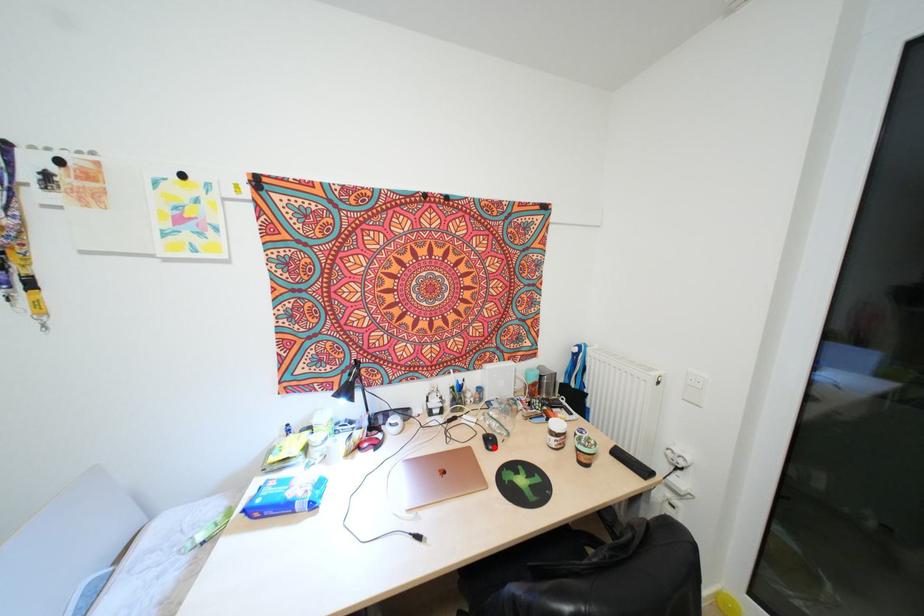
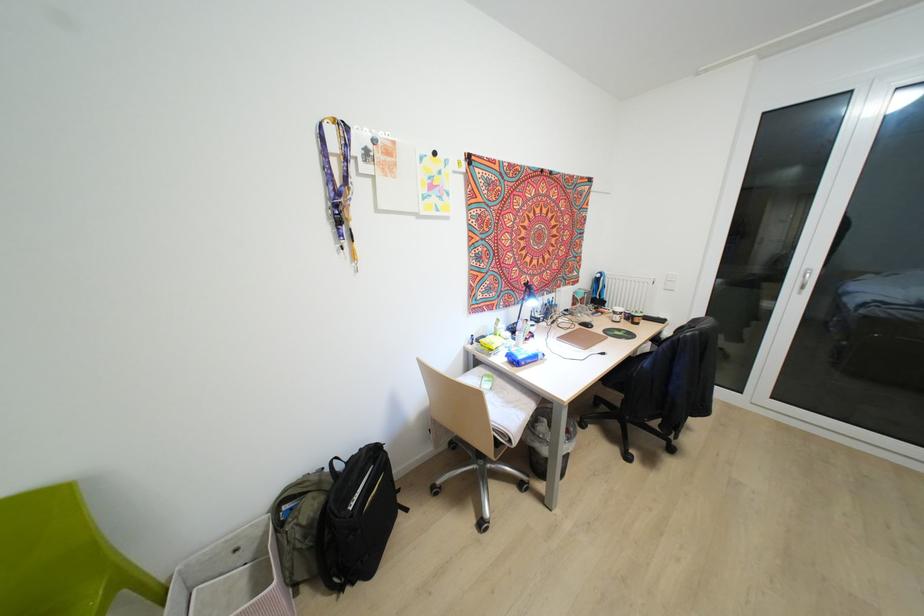
Question: I am providing you with two images of the same scene from different viewpoints. A red point is shown in image1. For the corresponding object point in image2, is it positioned nearer or farther from the camera?

Choices:
 (A) Nearer
 (B) Farther

Answer: (A)